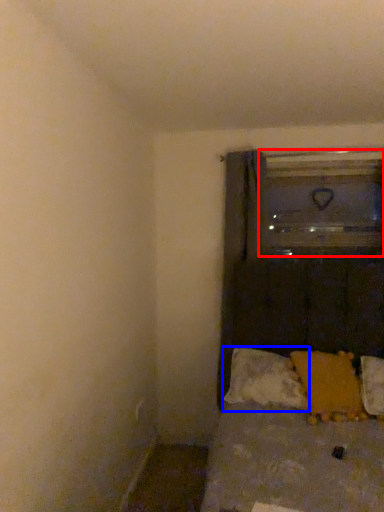
Question: Which point is closer to the camera, glass door (highlighted by a red box) or pillow (highlighted by a blue box)?

Choices:
 (A) glass door
 (B) pillow

Answer: (B)